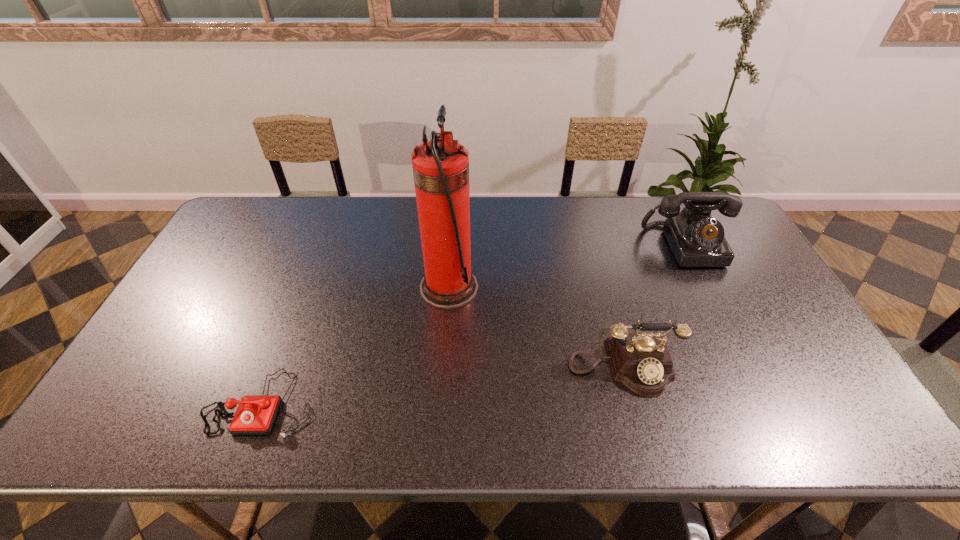
Where is `free space between the second object from left to right and the leftmost object`? This screenshot has width=960, height=540. free space between the second object from left to right and the leftmost object is located at coordinates (355, 345).

Locate an element on the screen. free space between the leftmost object and the second telephone from left to right is located at coordinates (443, 385).

You are a GUI agent. You are given a task and a screenshot of the screen. Output one action in this format:
    pyautogui.click(x=<x>, y=<y>)
    Task: Click on the empty location between the fire extinguisher and the second telephone from left to right
    The height and width of the screenshot is (540, 960).
    Given the screenshot: What is the action you would take?
    point(536,327)

Locate an element on the screen. The width and height of the screenshot is (960, 540). unoccupied area between the tallest object and the rightmost telephone is located at coordinates (568, 266).

Where is `free spot between the second object from right to left and the farthest telephone`? free spot between the second object from right to left and the farthest telephone is located at coordinates (655, 306).

The image size is (960, 540). I want to click on free spot between the third object from right to left and the second telephone from left to right, so click(536, 327).

The height and width of the screenshot is (540, 960). I want to click on free spot between the rightmost telephone and the tallest object, so [568, 266].

Identify the location of free space between the rightmost object and the tallest object. (568, 266).

Identify the location of object that is the second closest one to the leftmost object. (642, 362).

Locate an element on the screen. The image size is (960, 540). object that ranks as the second closest to the second object from left to right is located at coordinates (255, 415).